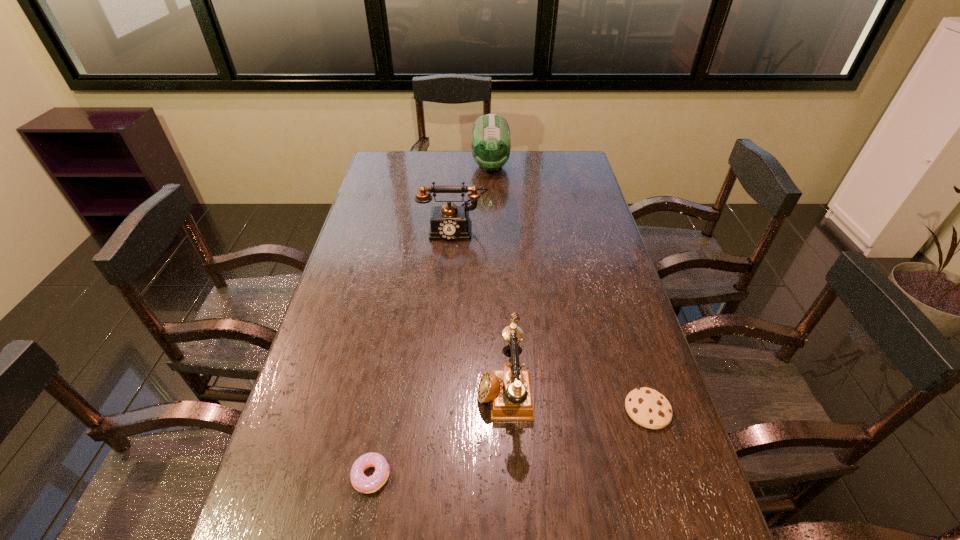
Where is `vacant space that satisfies the following two spatial constraints: 1. on the dial number of the cookie; 2. on the left side of the nearer telephone`? This screenshot has height=540, width=960. vacant space that satisfies the following two spatial constraints: 1. on the dial number of the cookie; 2. on the left side of the nearer telephone is located at coordinates (505, 410).

At what (x,y) coordinates should I click in order to perform the action: click on vacant area that satisfies the following two spatial constraints: 1. on the dial number of the nearer telephone; 2. on the right side of the rightmost object. Please return your answer as a coordinate pair (x, y). The height and width of the screenshot is (540, 960). Looking at the image, I should click on (505, 410).

Where is `vacant space that satisfies the following two spatial constraints: 1. on the visor of the rightmost object; 2. on the left side of the football helmet`? vacant space that satisfies the following two spatial constraints: 1. on the visor of the rightmost object; 2. on the left side of the football helmet is located at coordinates (x=499, y=410).

The image size is (960, 540). I want to click on free space that satisfies the following two spatial constraints: 1. on the visor of the football helmet; 2. on the right side of the rightmost object, so click(x=499, y=410).